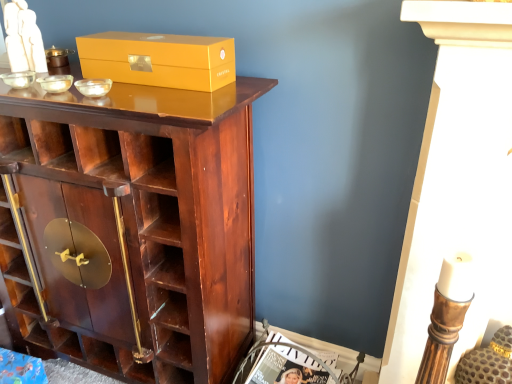
Question: From a real-world perspective, is matte gold box at upper center positioned under matte white magazine at lower center based on gravity?

Choices:
 (A) no
 (B) yes

Answer: (A)

Question: Is matte gold box at upper center positioned in front of matte white magazine at lower center?

Choices:
 (A) no
 (B) yes

Answer: (B)

Question: Does matte gold box at upper center turn towards matte white magazine at lower center?

Choices:
 (A) yes
 (B) no

Answer: (B)

Question: Is matte gold box at upper center completely or partially outside of matte white magazine at lower center?

Choices:
 (A) no
 (B) yes

Answer: (B)

Question: Could matte white magazine at lower center be considered to be inside matte gold box at upper center?

Choices:
 (A) no
 (B) yes

Answer: (A)

Question: Considering the positions of matte gold box at upper center and shiny dark wood cupboard at center in the image, is matte gold box at upper center wider or thinner than shiny dark wood cupboard at center?

Choices:
 (A) wide
 (B) thin

Answer: (B)

Question: Considering the relative positions of matte gold box at upper center and shiny dark wood cupboard at center in the image provided, is matte gold box at upper center to the left or to the right of shiny dark wood cupboard at center?

Choices:
 (A) right
 (B) left

Answer: (A)

Question: Choose the correct answer: Is matte gold box at upper center inside shiny dark wood cupboard at center or outside it?

Choices:
 (A) outside
 (B) inside

Answer: (A)

Question: In terms of height, does matte gold box at upper center look taller or shorter compared to shiny dark wood cupboard at center?

Choices:
 (A) tall
 (B) short

Answer: (B)

Question: Looking at the image, does matte white magazine at lower center seem bigger or smaller compared to shiny dark wood cupboard at center?

Choices:
 (A) small
 (B) big

Answer: (A)

Question: From a real-world perspective, is matte white magazine at lower center above or below shiny dark wood cupboard at center?

Choices:
 (A) above
 (B) below

Answer: (B)

Question: From their relative heights in the image, would you say matte white magazine at lower center is taller or shorter than shiny dark wood cupboard at center?

Choices:
 (A) short
 (B) tall

Answer: (A)

Question: Which is correct: matte white magazine at lower center is inside shiny dark wood cupboard at center, or outside of it?

Choices:
 (A) outside
 (B) inside

Answer: (A)

Question: Do you think matte white magazine at lower center is within matte gold box at upper center, or outside of it?

Choices:
 (A) inside
 (B) outside

Answer: (B)

Question: From the image's perspective, relative to matte gold box at upper center, is matte white magazine at lower center above or below?

Choices:
 (A) above
 (B) below

Answer: (B)